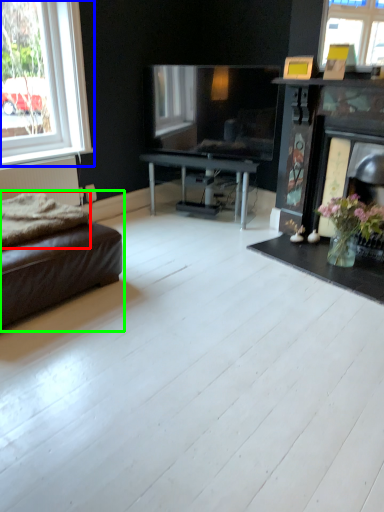
Question: Which object is positioned closest to blanket (highlighted by a red box)? Select from window (highlighted by a blue box) and studio couch (highlighted by a green box).

Choices:
 (A) window
 (B) studio couch

Answer: (B)